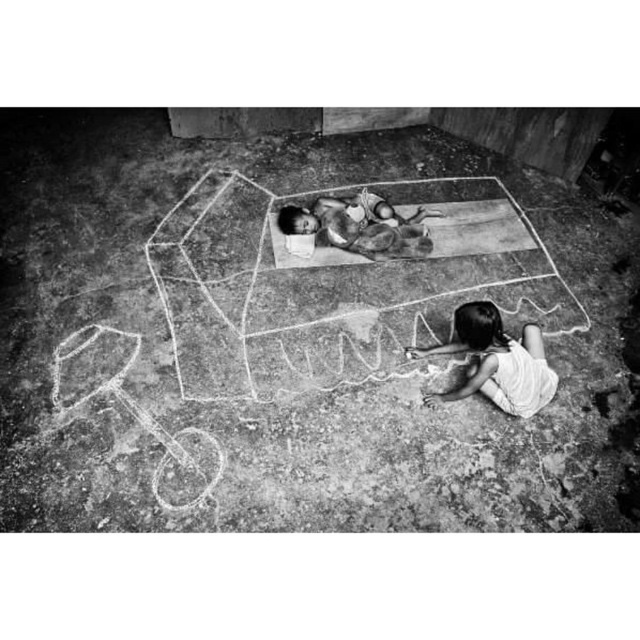
Who is more forward, (456, 332) or (328, 212)?

Point (456, 332) is more forward.

Identify the location of smooth white shirt at lower right. [x=496, y=362].